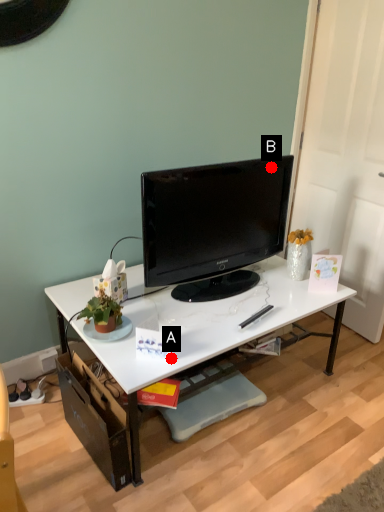
Question: Two points are circled on the image, labeled by A and B beside each circle. Which point is closer to the camera?

Choices:
 (A) A is closer
 (B) B is closer

Answer: (A)